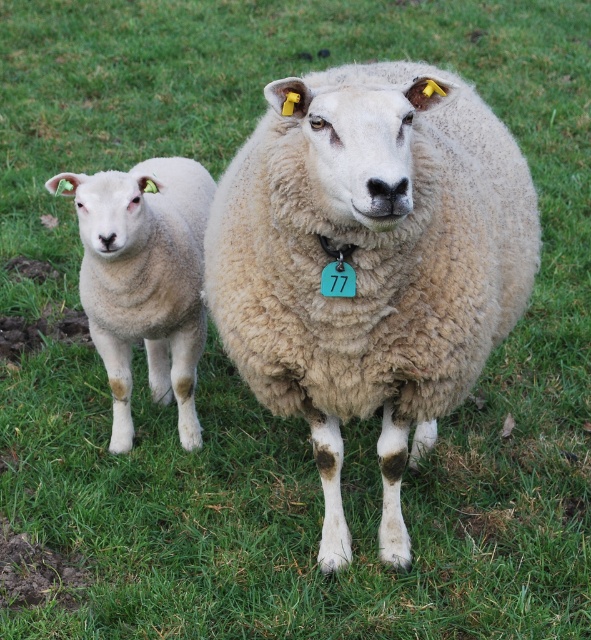
Question: Which of the following is the closest to the observer?

Choices:
 (A) (316, 179)
 (B) (134, 289)

Answer: (A)

Question: Does fuzzy beige sheep at center appear over white woolen lamb at left?

Choices:
 (A) yes
 (B) no

Answer: (A)

Question: Is fuzzy beige sheep at center to the left of white woolen lamb at left from the viewer's perspective?

Choices:
 (A) no
 (B) yes

Answer: (A)

Question: Does fuzzy beige sheep at center come in front of white woolen lamb at left?

Choices:
 (A) yes
 (B) no

Answer: (A)